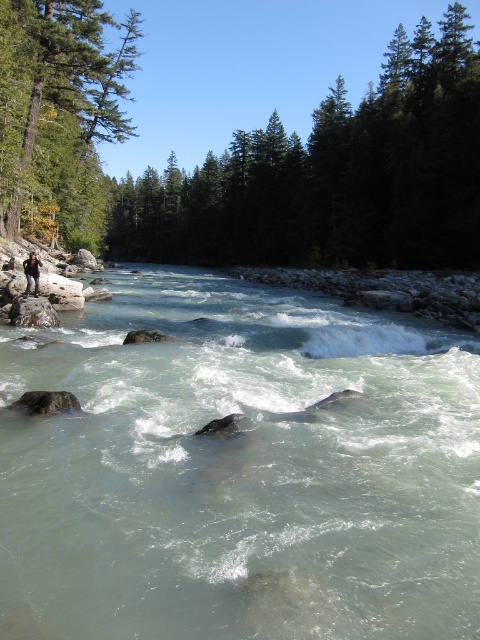
You are a hiker who wants to cross the river at the stream left. The clear water at stream left is where you need to step. Considering the green coniferous trees at upper center, which object is taller?

The green coniferous trees at upper center are taller than the clear water at stream left.

You are a hiker planning to cross the river at the clear water at stream left and the green coniferous trees at upper center. Based on the scene, which location would be safer to cross?

The clear water at stream left is safer to cross because it is below the green coniferous trees at upper center, indicating it might have calmer currents compared to the turbulent areas further downstream.

You are a hiker who wants to take a photo of the green matte tree at upper left and camouflage fabric backpack at lower left. Which object should you focus on first if you want to capture both in the frame without moving the camera?

You should focus on the green matte tree at upper left first because it is taller than the camouflage fabric backpack at lower left, so it will occupy more space in the frame and ensure both are visible without needing to adjust the camera position.